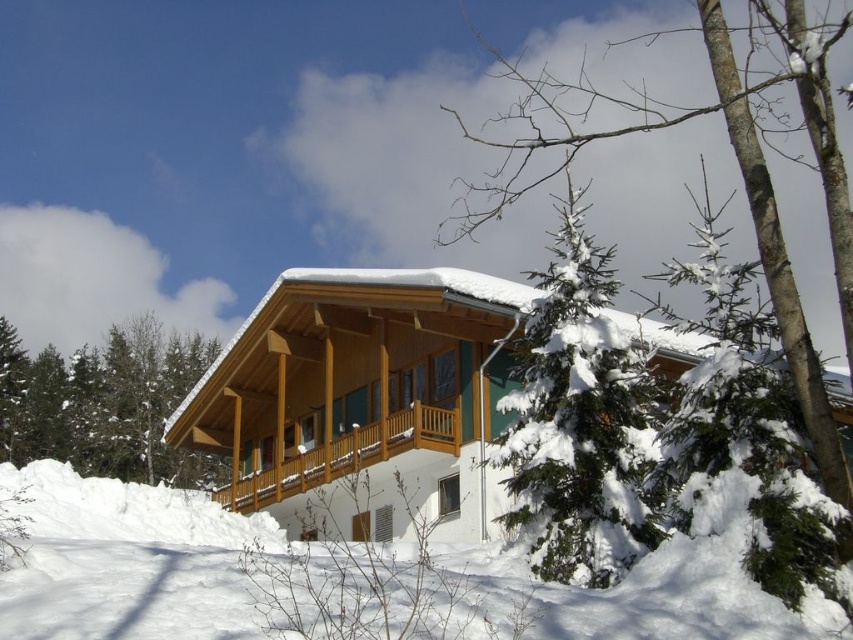
Question: Which of these objects is positioned farthest from the white fluffy snow at lower center?

Choices:
 (A) green textured pine tree at lower left
 (B) snow-covered evergreen at center
 (C) green needle-like tree at center

Answer: (A)

Question: Is green textured pine tree at lower left bigger than snow-covered evergreen at center?

Choices:
 (A) yes
 (B) no

Answer: (B)

Question: Does white fluffy snow at lower center appear on the left side of snow-covered evergreen at center?

Choices:
 (A) no
 (B) yes

Answer: (B)

Question: Estimate the real-world distances between objects in this image. Which object is farther from the white fluffy snow at lower center?

Choices:
 (A) green needle-like tree at center
 (B) snow-covered evergreen at center
 (C) wooden cabin at center
 (D) green textured pine tree at lower left

Answer: (D)

Question: Can you confirm if wooden cabin at center is positioned to the right of white fluffy snow at lower center?

Choices:
 (A) no
 (B) yes

Answer: (B)

Question: Which point is farther to the camera?

Choices:
 (A) wooden cabin at center
 (B) snow-covered evergreen at center
 (C) white fluffy snow at lower center

Answer: (A)